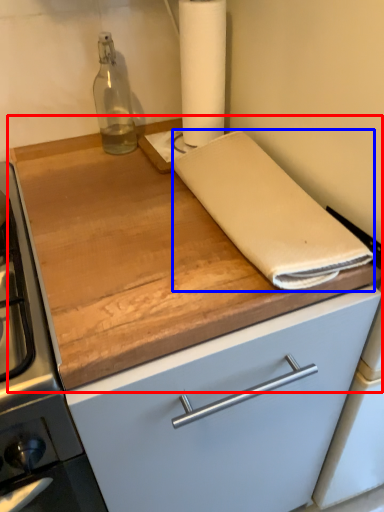
Question: Which object is closer to the camera taking this photo, countertop (highlighted by a red box) or linen (highlighted by a blue box)?

Choices:
 (A) countertop
 (B) linen

Answer: (A)